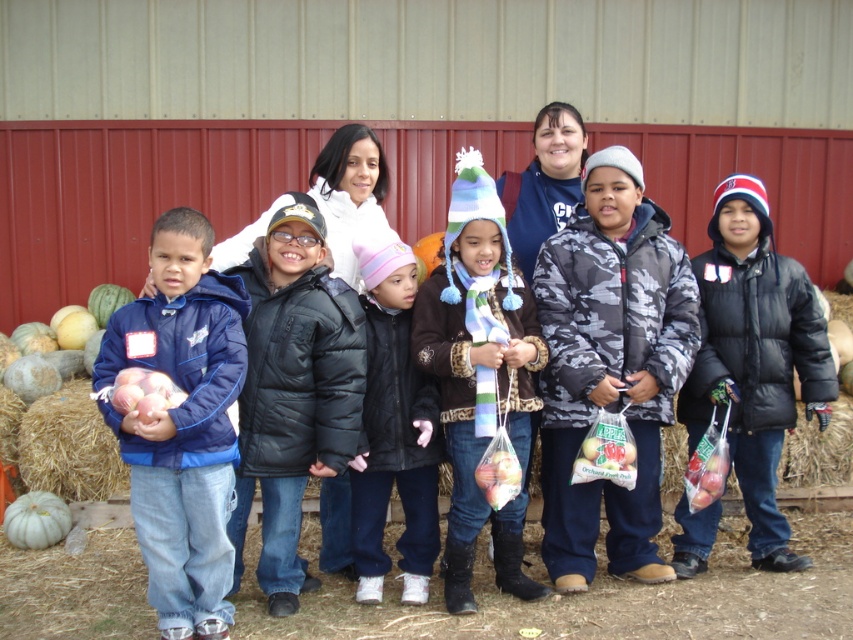
Question: Can you confirm if black puffy coat at center is positioned to the right of black quilted jacket at center?

Choices:
 (A) yes
 (B) no

Answer: (A)

Question: Which point is farther from the camera taking this photo?

Choices:
 (A) (74, 380)
 (B) (225, 589)

Answer: (A)

Question: Does blue fleece jacket at left have a greater width compared to black quilted jacket at center?

Choices:
 (A) yes
 (B) no

Answer: (A)

Question: Which object is the closest to the striped wool hat at center?

Choices:
 (A) black quilted jacket at center
 (B) camouflage jacket at center
 (C) blue fleece jacket at left

Answer: (A)

Question: Considering the real-world distances, which object is farthest from the striped wool hat at center?

Choices:
 (A) black quilted jacket at center
 (B) camouflage jacket at center
 (C) blue fleece jacket at left
 (D) black puffy coat at center

Answer: (C)

Question: Can you confirm if black puffy coat at center is bigger than brown straw bale at lower left?

Choices:
 (A) yes
 (B) no

Answer: (A)